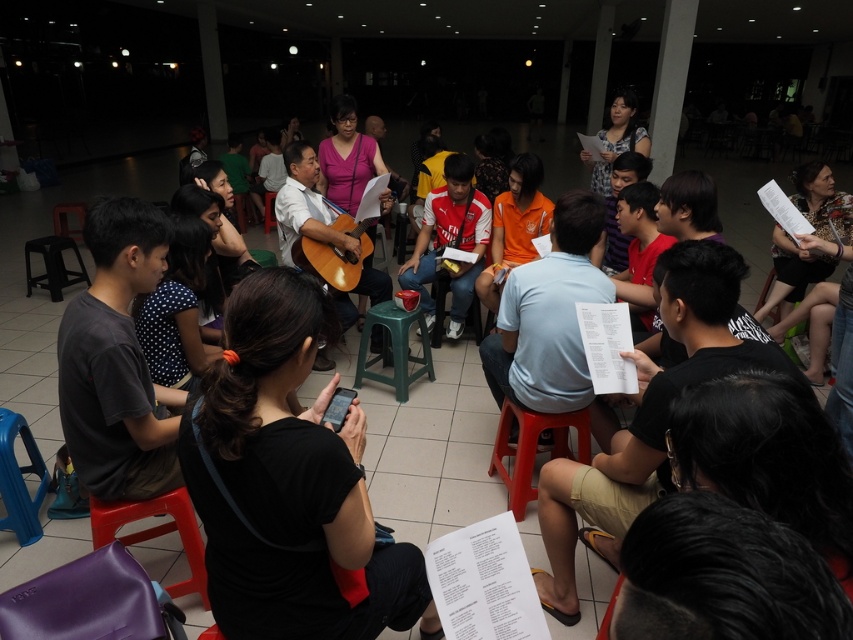
Question: Which point is closer to the camera?

Choices:
 (A) (514, 408)
 (B) (302, 232)
 (C) (173, 493)
 (D) (44, 248)

Answer: (C)

Question: Can you confirm if red plastic chair at lower center is thinner than wooden acoustic guitar at center?

Choices:
 (A) no
 (B) yes

Answer: (B)

Question: Which object appears farthest from the camera in this image?

Choices:
 (A) wooden acoustic guitar at center
 (B) black plastic stool at lower left
 (C) red plastic chair at lower center
 (D) purple plastic chair at lower left

Answer: (B)

Question: Which object is closer to the camera taking this photo?

Choices:
 (A) red plastic chair at lower center
 (B) black plastic stool at lower left
 (C) purple leather bag at lower left

Answer: (C)

Question: Can you confirm if purple leather bag at lower left is thinner than red plastic chair at lower center?

Choices:
 (A) no
 (B) yes

Answer: (A)

Question: Can you confirm if purple leather bag at lower left is thinner than purple plastic chair at lower left?

Choices:
 (A) yes
 (B) no

Answer: (B)